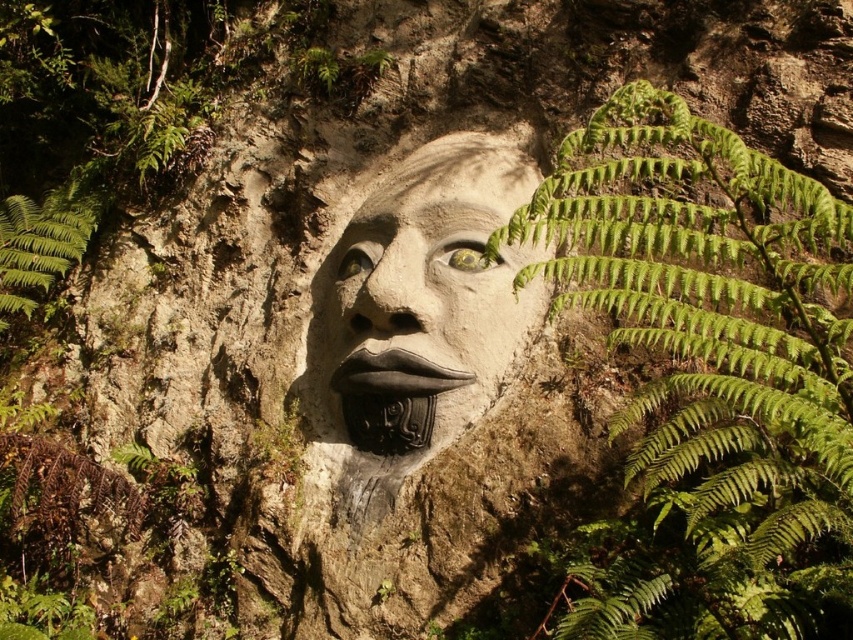
Where is `matte stone face at center`? Image resolution: width=853 pixels, height=640 pixels. matte stone face at center is located at coordinates (422, 300).

Who is taller, matte stone face at center or green leafy fern at left?

With more height is matte stone face at center.

Between point (413, 182) and point (97, 200), which one is positioned behind?

The point (97, 200) is more distant.

In order to click on matte stone face at center in this screenshot , I will do `click(422, 300)`.

Which is above, green leafy fern at right or black glossy lips at center?

green leafy fern at right is above.

Looking at this image, does green leafy fern at right appear over black glossy lips at center?

Yes.

Image resolution: width=853 pixels, height=640 pixels. I want to click on green leafy fern at right, so click(x=709, y=369).

Does matte stone face at center have a lesser height compared to black glossy lips at center?

Incorrect, matte stone face at center's height does not fall short of black glossy lips at center's.

Does matte stone face at center have a lesser width compared to black glossy lips at center?

No.

Is point (318, 333) closer to camera compared to point (412, 387)?

No, it is behind (412, 387).

Identify the location of matte stone face at center. (422, 300).